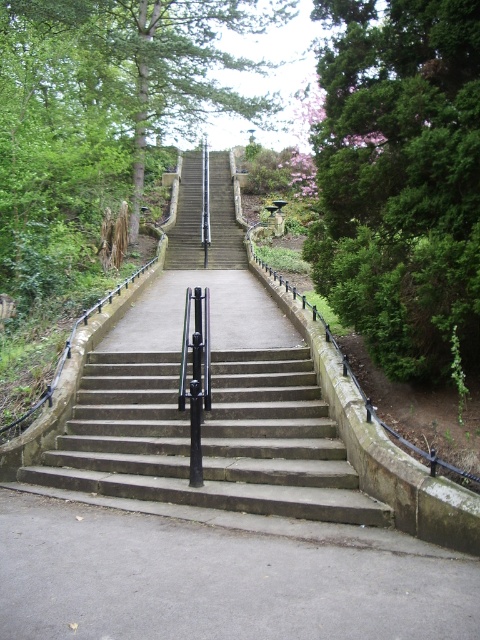
Question: Is the position of green leafy tree at upper left more distant than that of concrete stairs at center?

Choices:
 (A) yes
 (B) no

Answer: (A)

Question: Among these points, which one is nearest to the camera?

Choices:
 (A) (225, 440)
 (B) (385, 244)

Answer: (B)

Question: Among these objects, which one is farthest from the camera?

Choices:
 (A) green leafy tree at right
 (B) green leafy tree at upper left

Answer: (B)

Question: Which point appears closest to the camera in this image?

Choices:
 (A) (13, 132)
 (B) (346, 285)
 (C) (155, 392)

Answer: (B)

Question: Can you confirm if green leafy tree at right is positioned to the left of concrete stairs at center?

Choices:
 (A) yes
 (B) no

Answer: (B)

Question: Does green leafy tree at right appear under concrete stairs at center?

Choices:
 (A) yes
 (B) no

Answer: (B)